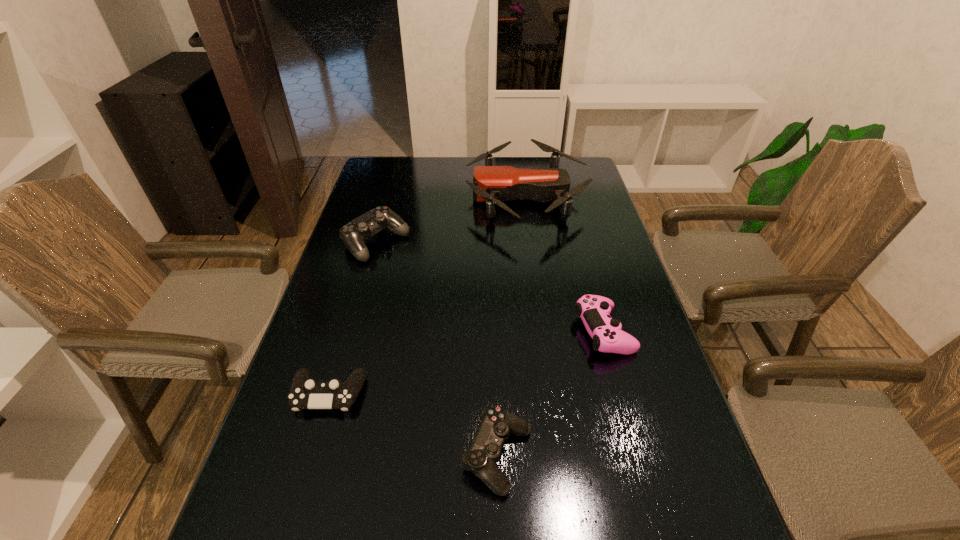
Find the location of a particular element. The height and width of the screenshot is (540, 960). vacant space at the far edge is located at coordinates (524, 158).

Where is `vacant region at the left edge of the desktop`? vacant region at the left edge of the desktop is located at coordinates (377, 314).

This screenshot has height=540, width=960. In order to click on vacant space at the right edge in this screenshot , I will do `click(647, 514)`.

Where is `vacant point located between the farthest control and the drone`? This screenshot has width=960, height=540. vacant point located between the farthest control and the drone is located at coordinates [x=451, y=220].

Identify the location of vacant area between the tallest control and the rightmost control. (490, 287).

You are a GUI agent. You are given a task and a screenshot of the screen. Output one action in this format:
    pyautogui.click(x=<x>, y=<y>)
    Task: Click on the vacant area that lies between the second tallest object and the shortest object
    This screenshot has height=540, width=960.
    Given the screenshot: What is the action you would take?
    pyautogui.click(x=352, y=319)

Locate an element on the screen. The image size is (960, 540). unoccupied area between the farthest control and the shortest control is located at coordinates (352, 319).

I want to click on vacant region between the second tallest object and the second control from right to left, so click(437, 350).

Where is `unoccupied position between the third farthest object and the drone`? unoccupied position between the third farthest object and the drone is located at coordinates (564, 264).

I want to click on vacant space that is in between the tallest object and the shortest object, so click(427, 295).